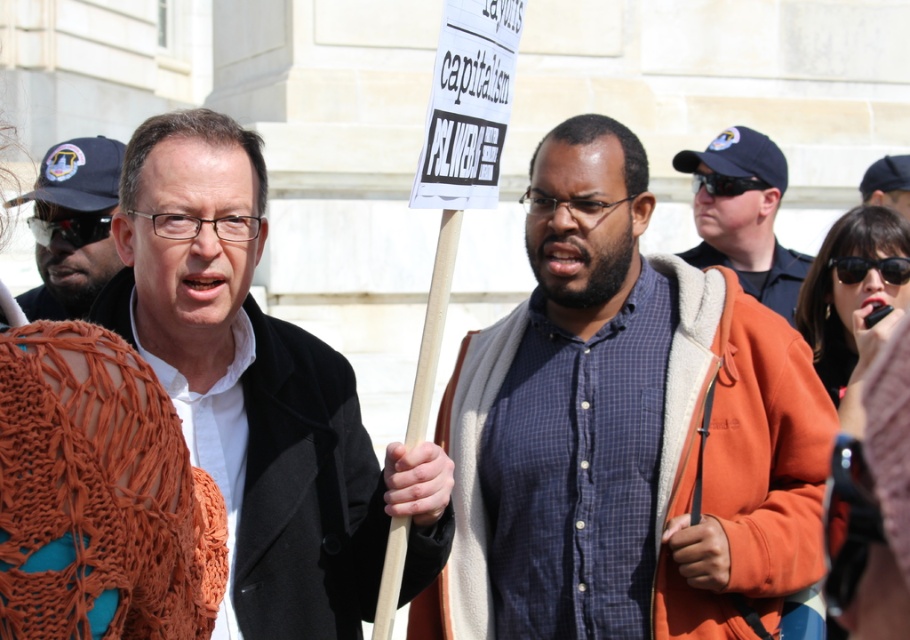
Between matte black sunglasses at left and dark brown hair at center, which one appears on the left side from the viewer's perspective?

Positioned to the left is matte black sunglasses at left.

Who is higher up, matte black sunglasses at left or dark brown hair at center?

dark brown hair at center is above.

Where is `matte black sunglasses at left`? The height and width of the screenshot is (640, 910). matte black sunglasses at left is located at coordinates (72, 227).

Locate an element on the screen. The width and height of the screenshot is (910, 640). matte black sunglasses at left is located at coordinates (72, 227).

The height and width of the screenshot is (640, 910). What do you see at coordinates (622, 433) in the screenshot? I see `blue plaid shirt at center` at bounding box center [622, 433].

Does blue plaid shirt at center have a greater width compared to blue uniform at center?

Indeed, blue plaid shirt at center has a greater width compared to blue uniform at center.

This screenshot has width=910, height=640. I want to click on blue plaid shirt at center, so click(x=622, y=433).

Identify the location of blue plaid shirt at center. Image resolution: width=910 pixels, height=640 pixels. (622, 433).

Does matte black coat at center have a greater height compared to blue uniform at center?

Yes.

In the scene shown: Who is more distant from viewer, (157, 355) or (724, 216)?

The point (724, 216) is behind.

The height and width of the screenshot is (640, 910). Find the location of `matte black coat at center`. matte black coat at center is located at coordinates (260, 392).